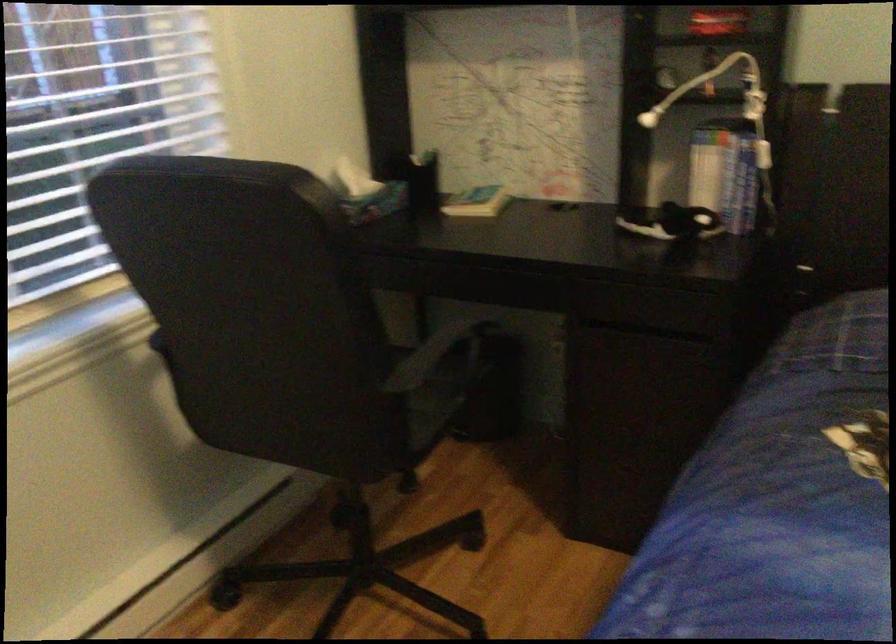
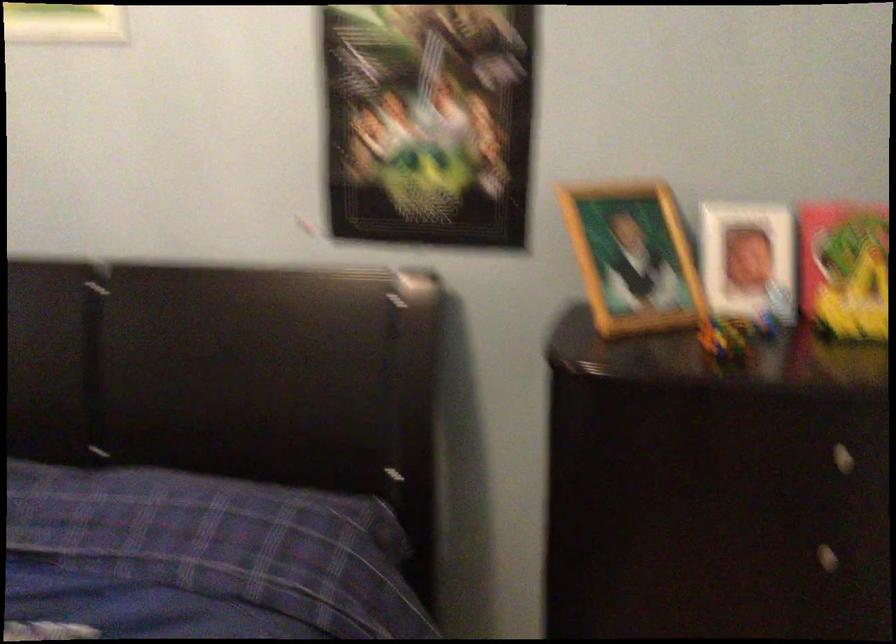
Question: What movement of the cameraman would produce the second image?

Choices:
 (A) Left
 (B) Right
 (C) Forward
 (D) Backward

Answer: (B)